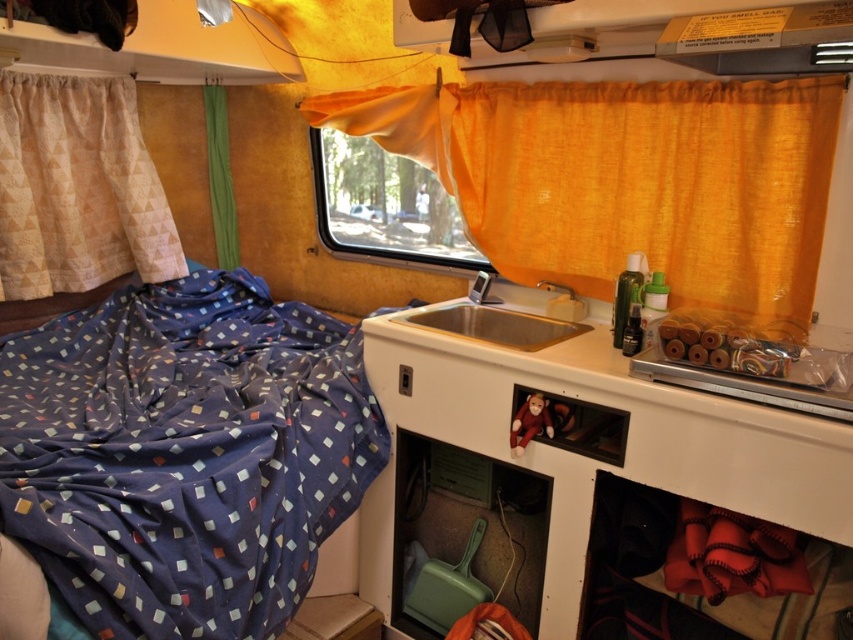
You are inside a camper van and need to wash your hands. You see an orange fabric window at center and a satin silver sink at center. Which object is taller?

The orange fabric window at center is taller than the satin silver sink at center.